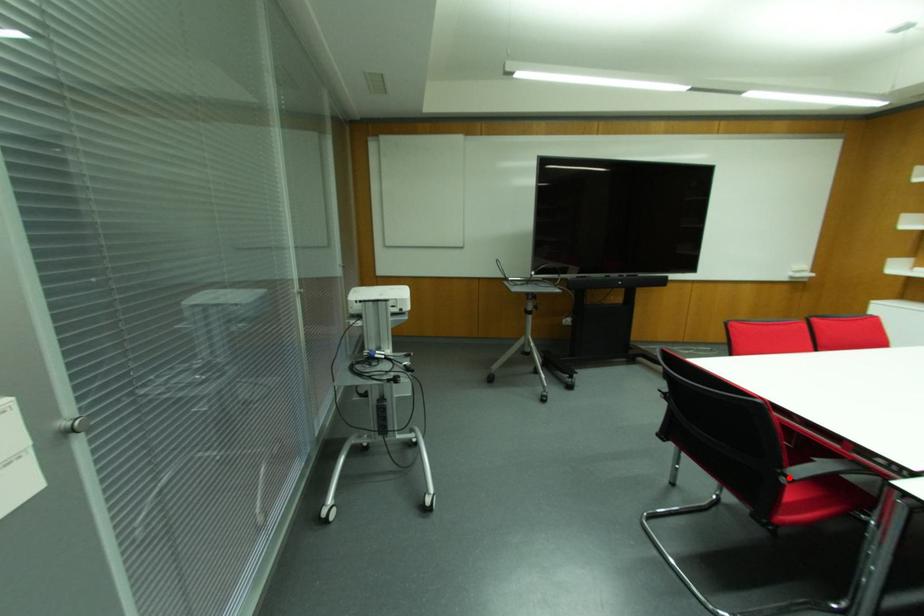
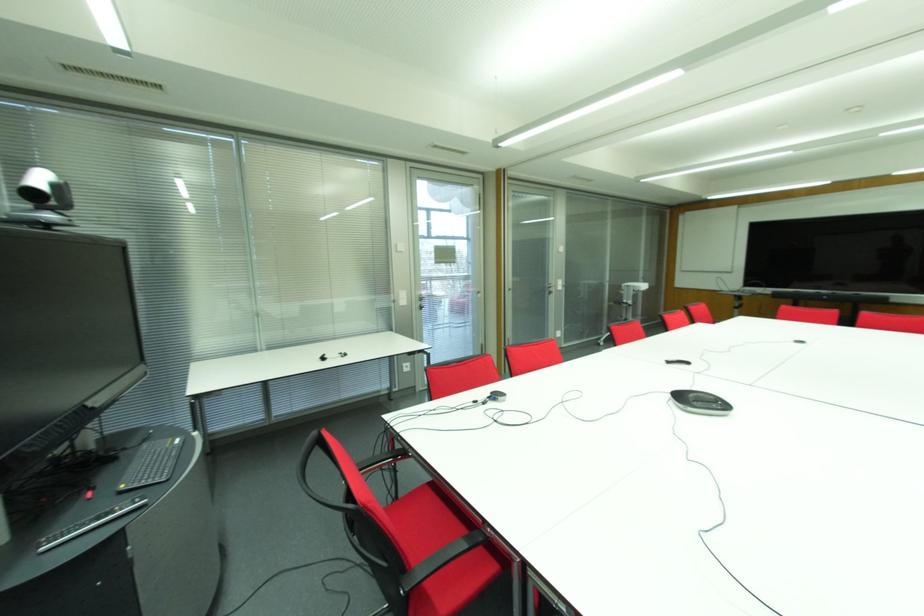
Question: I am providing you with two images of the same scene from different viewpoints. A red point is marked on the first image. Is the red point's position out of view in image 2?

Choices:
 (A) Yes
 (B) No

Answer: (A)